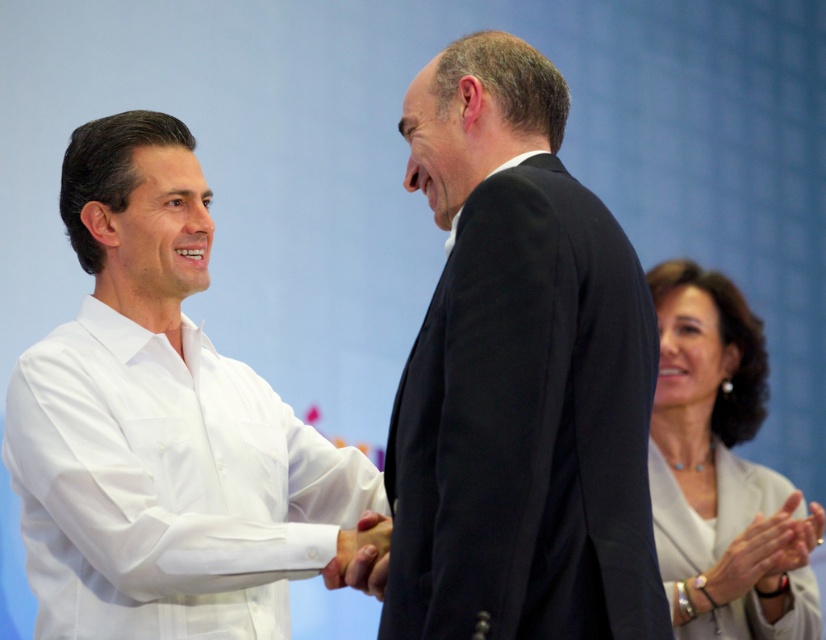
Find the location of a particular element. black suit at center is located at coordinates (518, 376).

This screenshot has width=826, height=640. Describe the element at coordinates (518, 376) in the screenshot. I see `black suit at center` at that location.

The width and height of the screenshot is (826, 640). Describe the element at coordinates (518, 376) in the screenshot. I see `black suit at center` at that location.

What are the coordinates of `black suit at center` in the screenshot? It's located at (518, 376).

Can you confirm if white cotton shirt at center is wider than smooth skin hand at lower right?

Yes, white cotton shirt at center is wider than smooth skin hand at lower right.

Which is behind, point (93, 566) or point (770, 577)?

Positioned behind is point (770, 577).

Between point (50, 476) and point (798, 541), which one is positioned behind?

Point (798, 541)

Identify the location of white cotton shirt at center. (160, 424).

Can you confirm if white cotton shirt at center is bigger than white matte hand at center?

Yes, white cotton shirt at center is bigger than white matte hand at center.

Is point (69, 202) closer to viewer compared to point (336, 588)?

No, (69, 202) is further to viewer.

Between point (320, 448) and point (378, 557), which one is positioned in front?

Point (378, 557)

This screenshot has width=826, height=640. What are the coordinates of `white cotton shirt at center` in the screenshot? It's located at (160, 424).